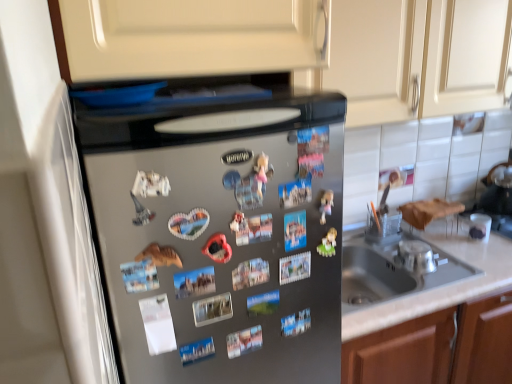
Question: Is silver metallic bowl at sink to the left or to the right of matte cream cabinet at upper center in the image?

Choices:
 (A) right
 (B) left

Answer: (B)

Question: Looking at the image, does silver metallic bowl at sink seem bigger or smaller compared to matte cream cabinet at upper center?

Choices:
 (A) small
 (B) big

Answer: (A)

Question: Based on their relative distances, which object is farther from the matte cream cabinet at upper center?

Choices:
 (A) silver metallic bowl at sink
 (B) matte plastic toy at center
 (C) satin silver refrigerator at center

Answer: (B)

Question: Estimate the real-world distances between objects in this image. Which object is farther from the matte cream cabinet at upper center?

Choices:
 (A) silver metallic bowl at sink
 (B) satin silver refrigerator at center
 (C) matte plastic toy at center

Answer: (C)